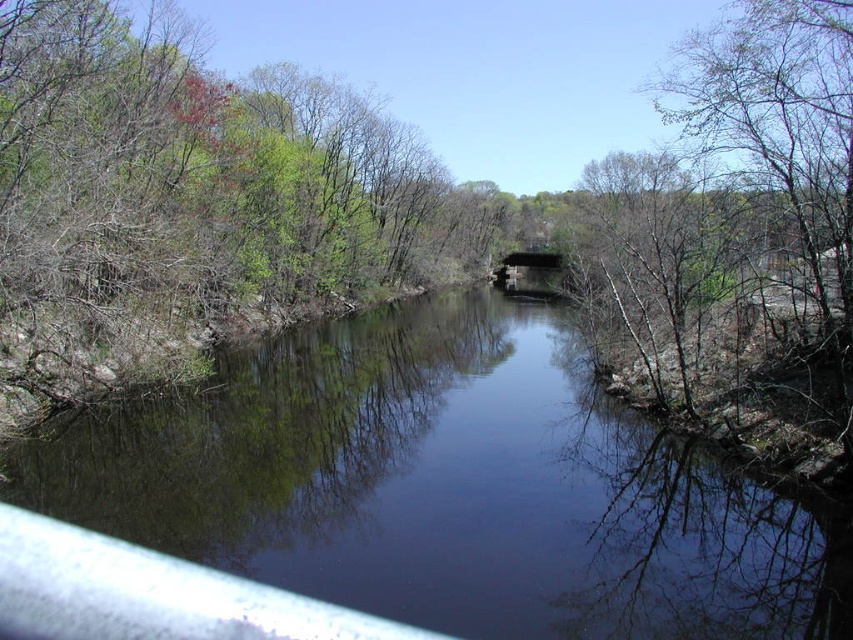
Does transparent water at center have a larger size compared to concrete bridge at center?

Incorrect, transparent water at center is not larger than concrete bridge at center.

In the scene shown: Is transparent water at center above concrete bridge at center?

No, transparent water at center is not above concrete bridge at center.

Is point (633, 492) positioned after point (515, 268)?

No, it is in front of (515, 268).

Find the location of a particular element. The height and width of the screenshot is (640, 853). transparent water at center is located at coordinates (450, 486).